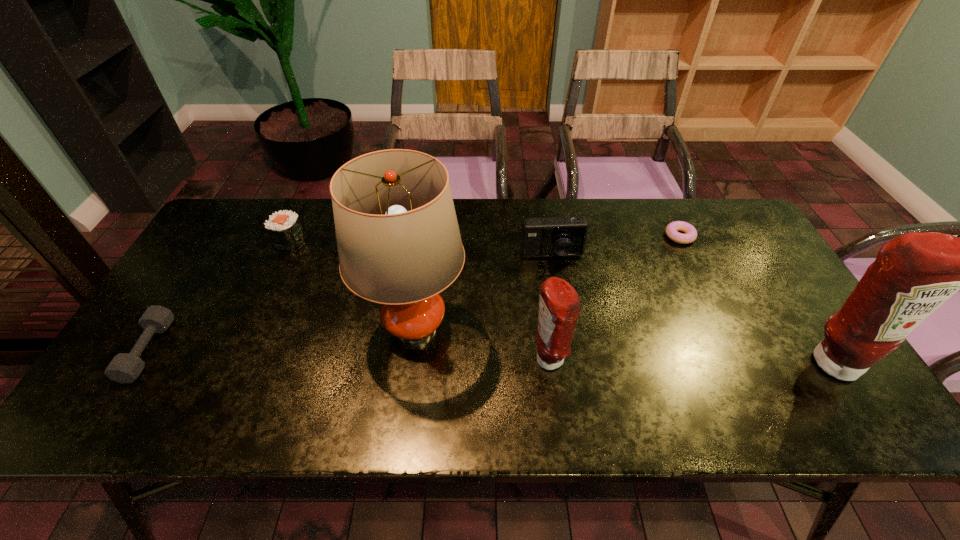
You are a GUI agent. You are given a task and a screenshot of the screen. Output one action in this format:
    pyautogui.click(x=<x>, y=<y>)
    Task: Click on the shorter condiment
    This screenshot has width=960, height=540.
    Given the screenshot: What is the action you would take?
    pyautogui.click(x=559, y=304)

Identify the location of the left condiment. (559, 304).

At what (x,y) coordinates should I click in order to perform the action: click on the rightmost object. Please return your answer as a coordinate pair (x, y). Image resolution: width=960 pixels, height=540 pixels. Looking at the image, I should click on (915, 273).

Locate an element on the screen. This screenshot has width=960, height=540. the right condiment is located at coordinates coord(915,273).

The image size is (960, 540). Identify the location of camera. (552, 236).

The width and height of the screenshot is (960, 540). Identify the location of sushi. (284, 228).

Identify the location of the third shortest object. The height and width of the screenshot is (540, 960). (284, 228).

Locate an element on the screen. the second object from right to left is located at coordinates (672, 228).

In order to click on the shortest object in this screenshot , I will do (672, 228).

The image size is (960, 540). Identify the location of lamp. (398, 240).